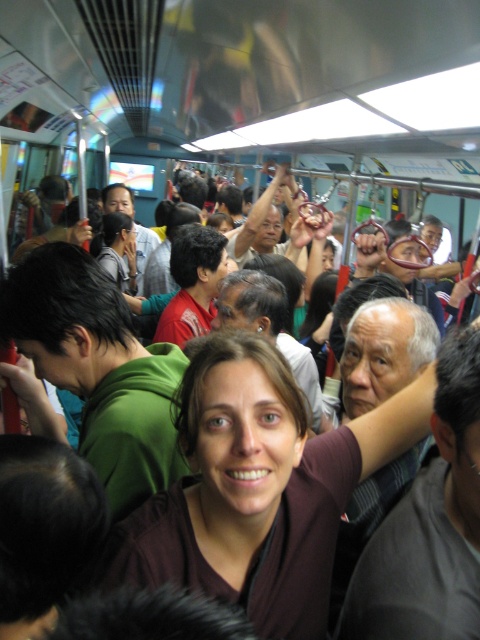
You are a passenger on a subway train and you notice two people wearing a brown matte shirt at center and a matte green shirt at center. Which of these two shirts is positioned lower in the scene?

The brown matte shirt at center is positioned below the matte green shirt at center, so it is lower in the scene.

You are a delivery person carrying a box that is 3.5 meters long. You are standing in the subway train and see the brown matte shirt at center and the matte green shirt at center. Can you fit your box between them without bending it?

The brown matte shirt at center is 3.40 meters from matte green shirt at center. Since the box is 3.5 meters long, it won not fit between them as the distance is shorter than the box length.

You are a passenger on the subway train and notice two people wearing a brown matte shirt at center and a matte green shirt at center. Which shirt is positioned to the right of the other?

The brown matte shirt at center is to the right of the matte green shirt at center.